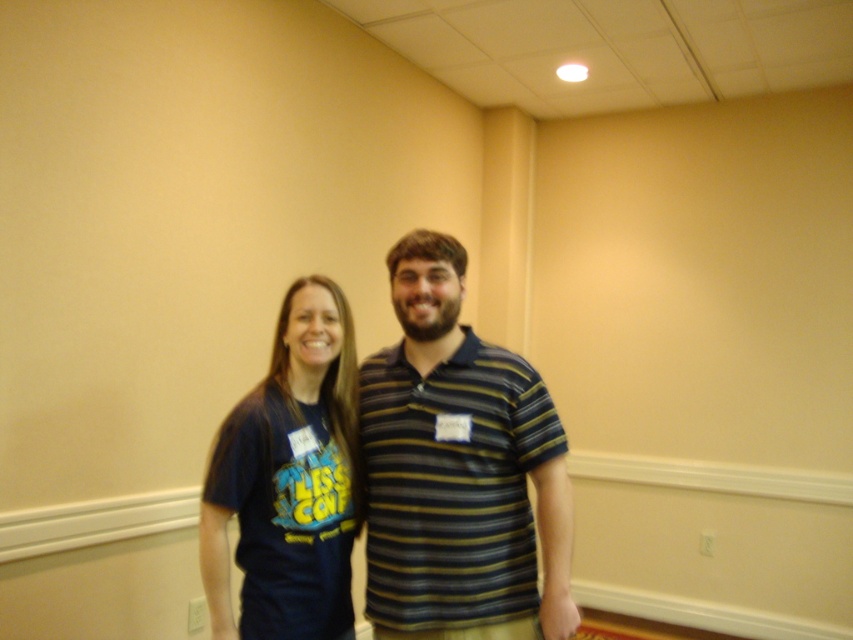
What do you see at coordinates (457, 468) in the screenshot?
I see `striped polo shirt at center` at bounding box center [457, 468].

In the scene shown: Is striped polo shirt at center in front of dark blue t-shirt at left?

No.

What do you see at coordinates (457, 468) in the screenshot? Image resolution: width=853 pixels, height=640 pixels. I see `striped polo shirt at center` at bounding box center [457, 468].

You are a GUI agent. You are given a task and a screenshot of the screen. Output one action in this format:
    pyautogui.click(x=<x>, y=<y>)
    Task: Click on the striped polo shirt at center
    Image resolution: width=853 pixels, height=640 pixels.
    Given the screenshot: What is the action you would take?
    pyautogui.click(x=457, y=468)